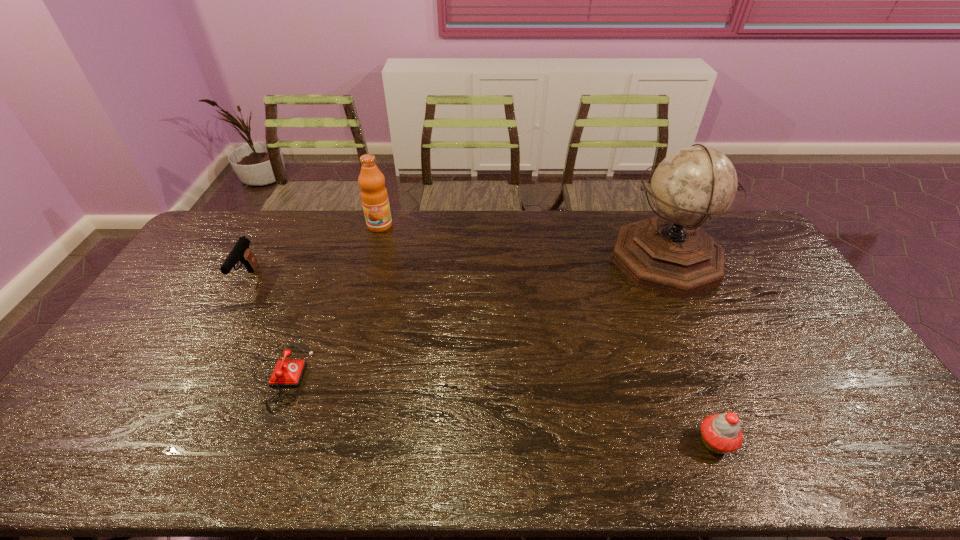
What are the coordinates of `globe` in the screenshot? It's located at (670, 254).

This screenshot has width=960, height=540. Find the location of `the third object from left to right`. the third object from left to right is located at coordinates (374, 196).

At what (x,y) coordinates should I click in order to perform the action: click on the fourth shortest object. Please return your answer as a coordinate pair (x, y). This screenshot has height=540, width=960. Looking at the image, I should click on (374, 196).

This screenshot has width=960, height=540. Identify the location of the leftmost object. (241, 251).

You are a GUI agent. You are given a task and a screenshot of the screen. Output one action in this format:
    pyautogui.click(x=<x>, y=<y>)
    Task: Click on the nearest object
    
    Given the screenshot: What is the action you would take?
    pyautogui.click(x=720, y=433)

At what (x,y) coordinates should I click in order to perform the action: click on the fourth farthest object. Please return your answer as a coordinate pair (x, y). Looking at the image, I should click on (287, 373).

I want to click on the fourth object from right to left, so click(287, 373).

Locate an element on the screen. This screenshot has height=540, width=960. free space located on the surface of the globe is located at coordinates tap(540, 260).

The width and height of the screenshot is (960, 540). I want to click on vacant space located 0.380m on the surface of the globe, so click(x=503, y=260).

The height and width of the screenshot is (540, 960). I want to click on vacant area situated on the surface of the globe, so click(594, 260).